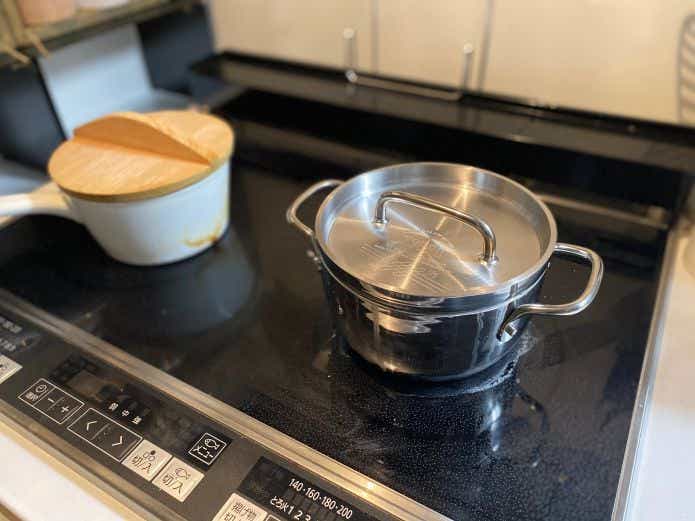
In order to click on numbers on the stove buttons in this screenshot , I will do `click(308, 490)`.